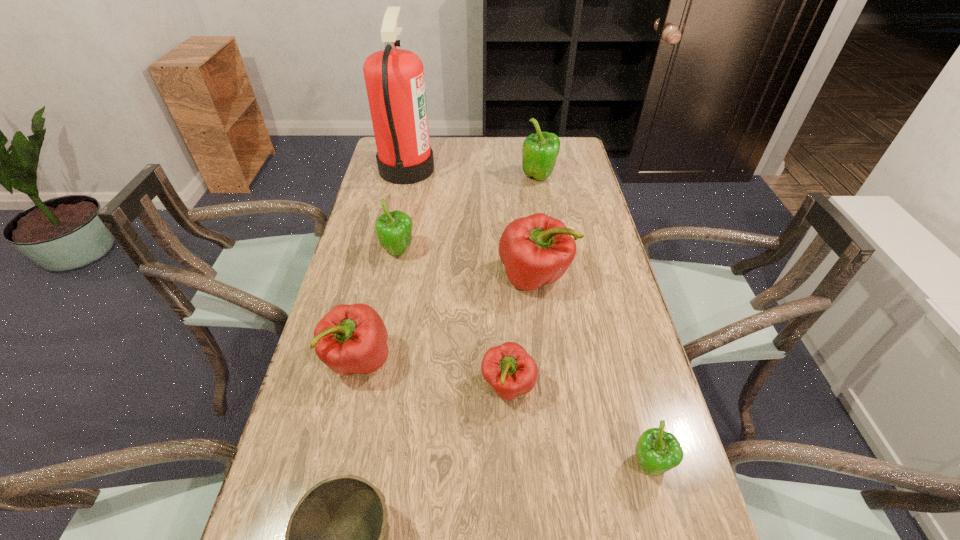
Where is `the tallest object`? the tallest object is located at coordinates (394, 78).

The height and width of the screenshot is (540, 960). Identify the location of fire extinguisher. (394, 78).

Where is `the biggest green bell pepper`? The height and width of the screenshot is (540, 960). the biggest green bell pepper is located at coordinates (540, 150).

Identify the location of the second green bell pepper from right to left. The width and height of the screenshot is (960, 540). (540, 150).

Identify the location of the farthest pink bell pepper. The image size is (960, 540). (538, 249).

Locate an element on the screen. This screenshot has width=960, height=540. the second smallest green bell pepper is located at coordinates (394, 229).

What are the coordinates of `the leftmost green bell pepper` in the screenshot? It's located at (394, 229).

At what (x,y) coordinates should I click in order to perform the action: click on the second smallest pink bell pepper. Please return your answer as a coordinate pair (x, y). This screenshot has height=540, width=960. Looking at the image, I should click on (351, 339).

Locate an element on the screen. The height and width of the screenshot is (540, 960). the seventh farthest object is located at coordinates (657, 451).

Find the location of a particular element. The image size is (960, 540). the nearest bell pepper is located at coordinates (657, 451).